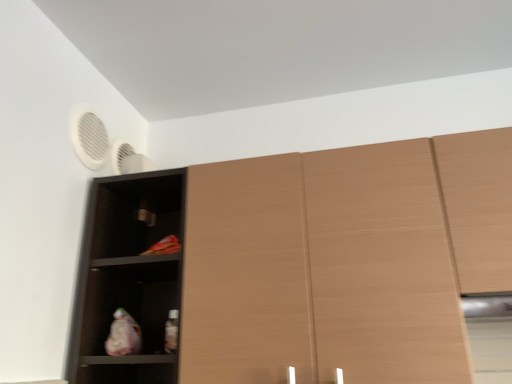
Question: Should I look upward or downward to see matte black shelf at left?

Choices:
 (A) down
 (B) up

Answer: (A)

Question: Is white matte fan at upper left facing away from light brown wood cabinet at right?

Choices:
 (A) no
 (B) yes

Answer: (A)

Question: Does white matte fan at upper left contain light brown wood cabinet at right?

Choices:
 (A) yes
 (B) no

Answer: (B)

Question: Does white matte fan at upper left appear on the right side of light brown wood cabinet at right?

Choices:
 (A) yes
 (B) no

Answer: (B)

Question: Can you see white matte fan at upper left touching light brown wood cabinet at right?

Choices:
 (A) yes
 (B) no

Answer: (B)

Question: Considering the relative sizes of white matte fan at upper left and light brown wood cabinet at right in the image provided, is white matte fan at upper left bigger than light brown wood cabinet at right?

Choices:
 (A) yes
 (B) no

Answer: (B)

Question: From a real-world perspective, is white matte fan at upper left physically above light brown wood cabinet at right?

Choices:
 (A) yes
 (B) no

Answer: (A)

Question: Can you confirm if matte black shelf at left is shorter than white matte fan at upper left?

Choices:
 (A) yes
 (B) no

Answer: (B)

Question: Is matte black shelf at left positioned with its back to white matte fan at upper left?

Choices:
 (A) no
 (B) yes

Answer: (A)

Question: From a real-world perspective, is matte black shelf at left below white matte fan at upper left?

Choices:
 (A) yes
 (B) no

Answer: (A)

Question: From the image's perspective, is matte black shelf at left below white matte fan at upper left?

Choices:
 (A) yes
 (B) no

Answer: (A)

Question: Is matte black shelf at left thinner than white matte fan at upper left?

Choices:
 (A) no
 (B) yes

Answer: (A)

Question: Is matte black shelf at left next to white matte fan at upper left and touching it?

Choices:
 (A) no
 (B) yes

Answer: (A)

Question: Does white matte fan at upper left come behind wooden cupboard at center?

Choices:
 (A) no
 (B) yes

Answer: (B)